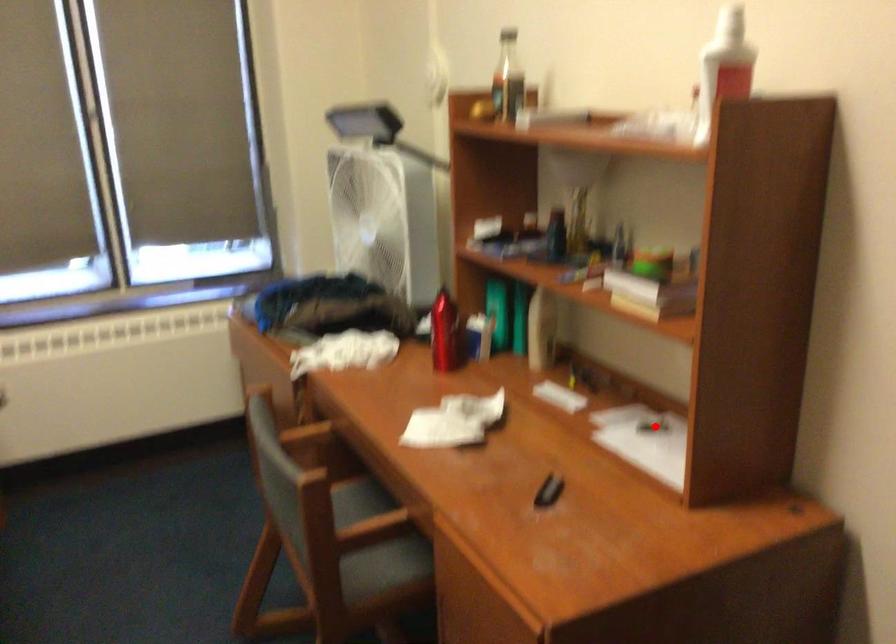
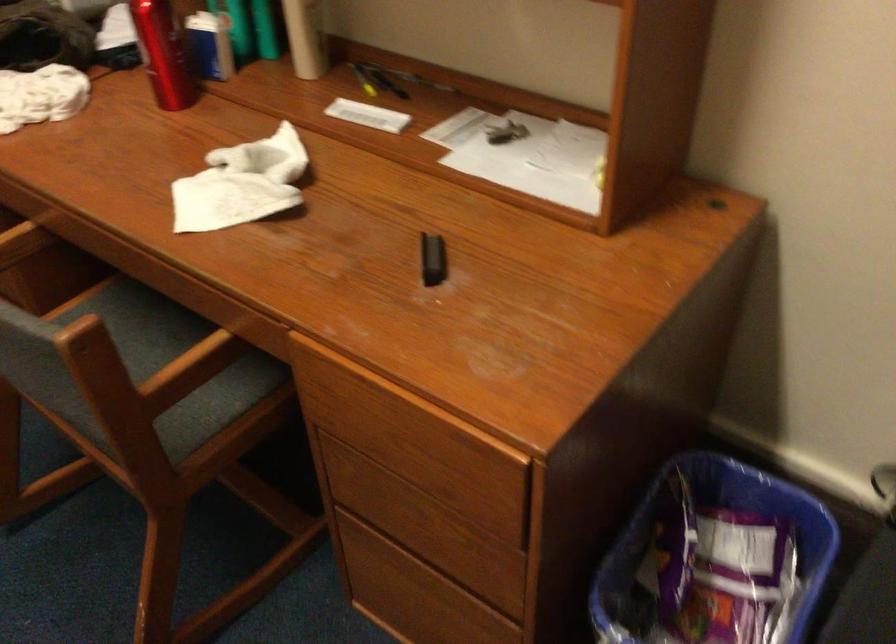
Question: I am providing you with two images of the same scene from different viewpoints. In image1, a red point is highlighted. Considering the same 3D point in image2, which of the following is correct?

Choices:
 (A) It is closer
 (B) It is farther

Answer: (A)